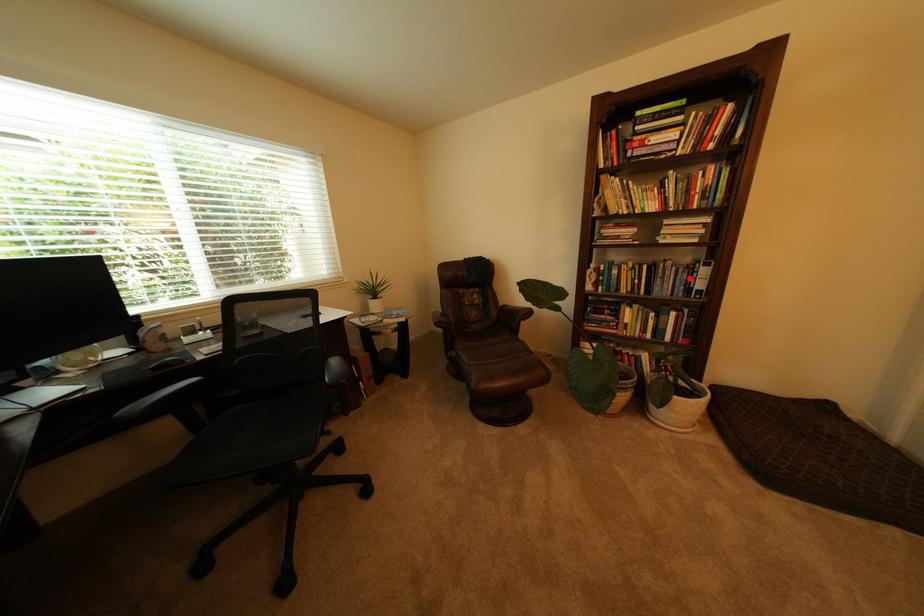
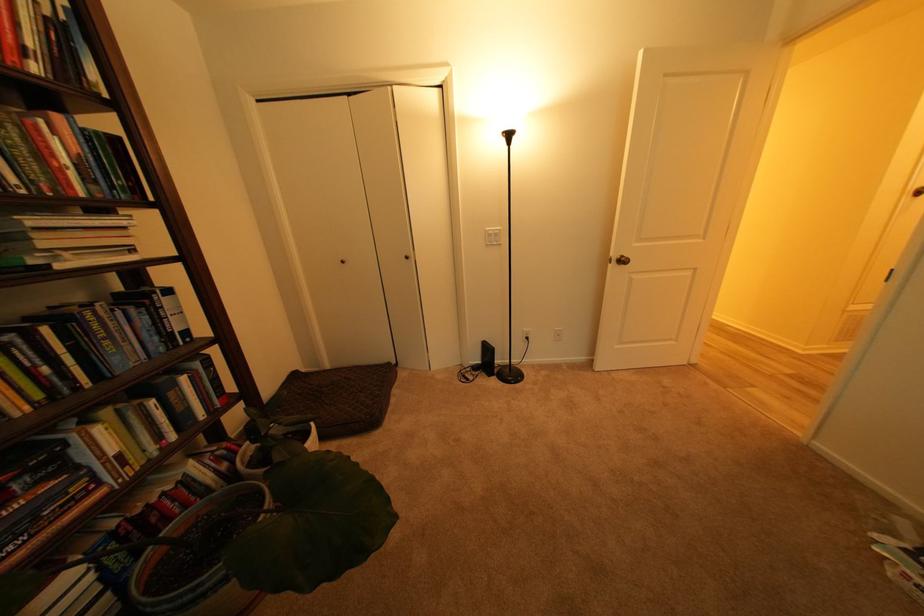
Find the pixel in the second image that matches the highlighted location in the first image.

(150, 326)